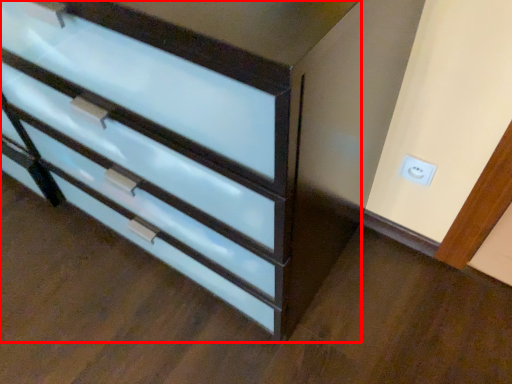
Question: Where is chest of drawers (annotated by the red box) located in relation to electric outlet in the image?

Choices:
 (A) left
 (B) right

Answer: (A)